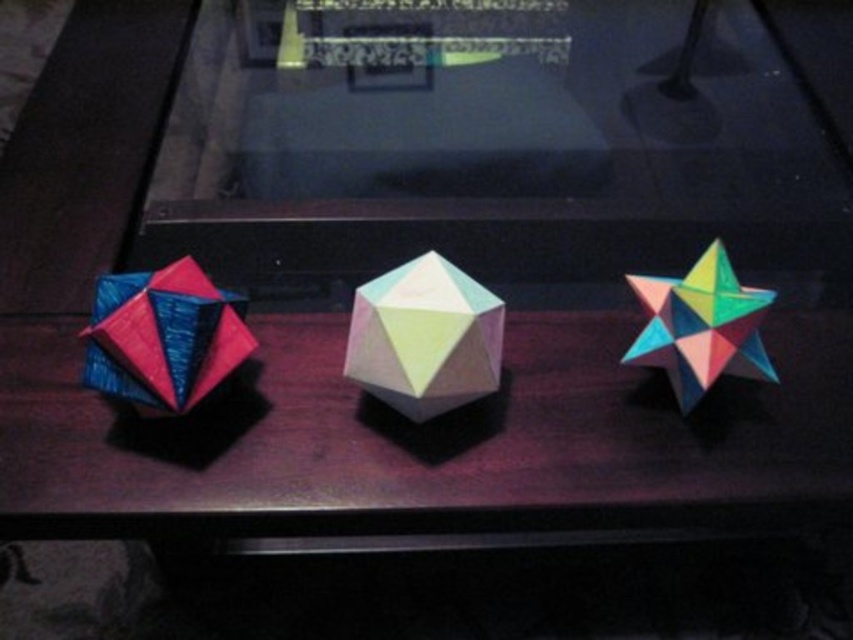
Question: Which point is closer to the camera?

Choices:
 (A) multicolored paper star at right
 (B) shiny blue and pink paper cube at left
 (C) pastel paper polyhedron at center

Answer: (B)

Question: Considering the real-world distances, which object is farthest from the multicolored paper star at right?

Choices:
 (A) pastel paper polyhedron at center
 (B) shiny blue and pink paper cube at left

Answer: (B)

Question: Does pastel paper polyhedron at center have a smaller size compared to multicolored paper star at right?

Choices:
 (A) yes
 (B) no

Answer: (B)

Question: Is pastel paper polyhedron at center below multicolored paper star at right?

Choices:
 (A) yes
 (B) no

Answer: (A)

Question: Which point is farther to the camera?

Choices:
 (A) shiny blue and pink paper cube at left
 (B) multicolored paper star at right

Answer: (B)

Question: Can you confirm if pastel paper polyhedron at center is positioned above shiny blue and pink paper cube at left?

Choices:
 (A) yes
 (B) no

Answer: (B)